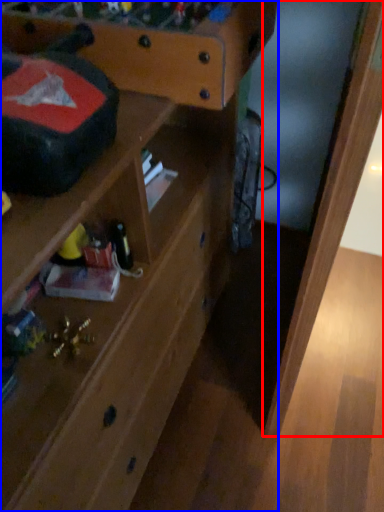
Question: Among these objects, which one is farthest to the camera, wood (highlighted by a red box) or shelf (highlighted by a blue box)?

Choices:
 (A) wood
 (B) shelf

Answer: (A)